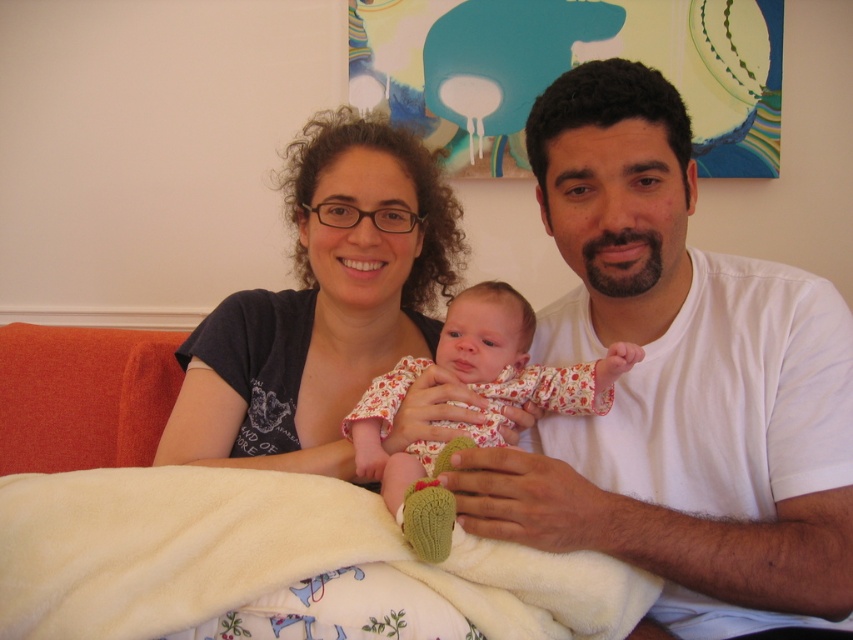
Can you confirm if white soft blanket at lower center is taller than matte black shirt at center?

No.

Can you confirm if white soft blanket at lower center is positioned to the left of matte black shirt at center?

Indeed, white soft blanket at lower center is positioned on the left side of matte black shirt at center.

Find the location of a particular element. white soft blanket at lower center is located at coordinates (262, 556).

Who is shorter, white cotton shirt at center or floral fabric baby at center?

floral fabric baby at center is shorter.

Does white cotton shirt at center come in front of floral fabric baby at center?

That is False.

Between point (834, 340) and point (445, 365), which one is positioned behind?

Point (445, 365)

At what (x,y) coordinates should I click in order to perform the action: click on white cotton shirt at center. Please return your answer as a coordinate pair (x, y). This screenshot has width=853, height=640. Looking at the image, I should click on (677, 385).

Does point (821, 301) lie behind point (434, 220)?

No, (821, 301) is closer to viewer.

Between white cotton shirt at center and matte black shirt at center, which one is positioned lower?

white cotton shirt at center is lower down.

Who is more forward, (701,257) or (386,186)?

Point (701,257) is more forward.

Find the location of a particular element. white cotton shirt at center is located at coordinates (677, 385).